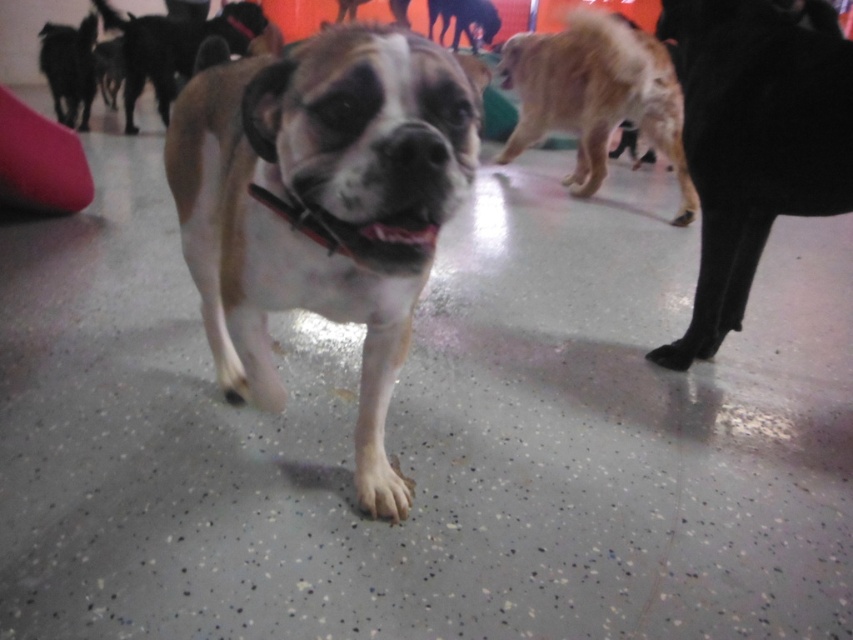
You are a dog trainer observing the scene. You notice the golden fur dog at upper right and the black fur dog at upper left. Which dog would you estimate to be bigger in size?

The golden fur dog at upper right is larger in size compared to the black fur dog at upper left.